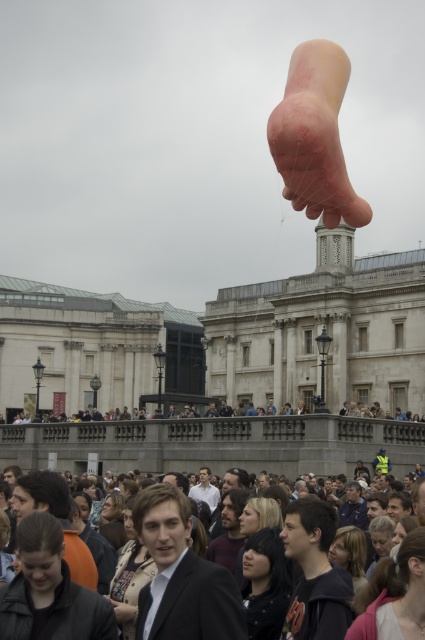
Question: Is white stone building at center below matte black suit at center?

Choices:
 (A) no
 (B) yes

Answer: (A)

Question: Among these objects, which one is farthest from the camera?

Choices:
 (A) white stone building at center
 (B) pink rubber foot at upper center

Answer: (A)

Question: Is pink rubber foot at upper center bigger than matte black suit at center?

Choices:
 (A) yes
 (B) no

Answer: (A)

Question: Is white stone building at center above pink rubber foot at upper center?

Choices:
 (A) no
 (B) yes

Answer: (A)

Question: Among these points, which one is nearest to the camera?

Choices:
 (A) (152, 541)
 (B) (384, 392)

Answer: (A)

Question: Which object appears closest to the camera in this image?

Choices:
 (A) pink rubber foot at upper center
 (B) matte black suit at center

Answer: (B)